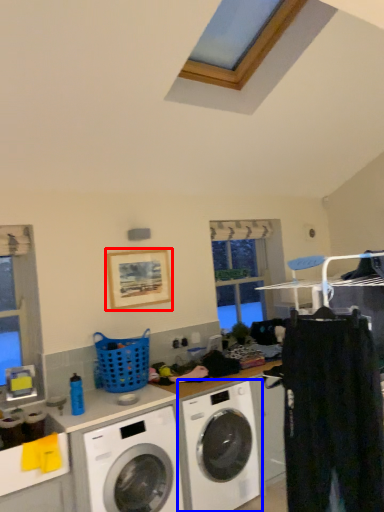
Question: Among these objects, which one is farthest to the camera, picture frame (highlighted by a red box) or washing machine (highlighted by a blue box)?

Choices:
 (A) picture frame
 (B) washing machine

Answer: (A)